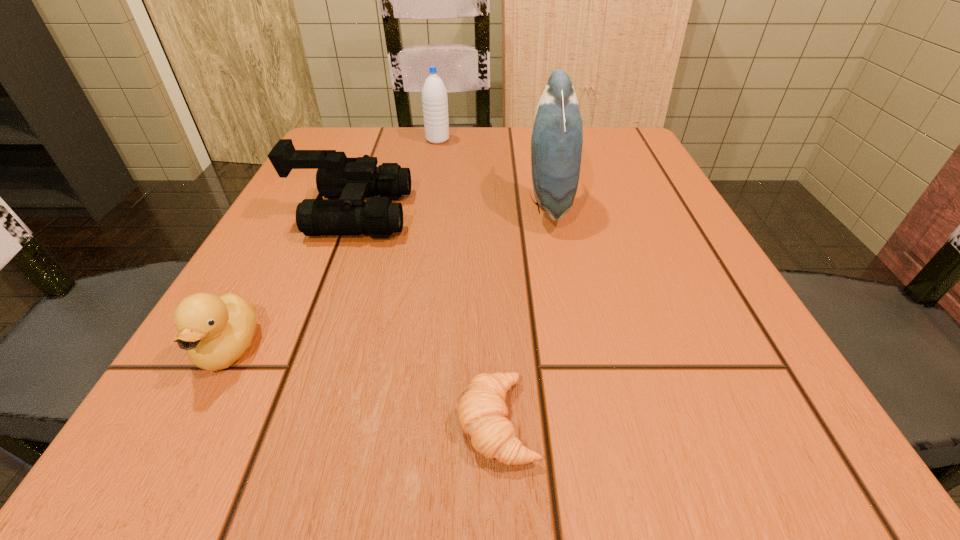
Where is `the tallest object`? The image size is (960, 540). the tallest object is located at coordinates click(x=557, y=136).

Identify the location of bird. The image size is (960, 540). (557, 136).

This screenshot has height=540, width=960. I want to click on the farthest object, so click(x=434, y=94).

Where is `the fourth shortest object`? Image resolution: width=960 pixels, height=540 pixels. the fourth shortest object is located at coordinates (434, 94).

Find the location of a particular element. the third shortest object is located at coordinates (351, 180).

This screenshot has width=960, height=540. I want to click on the fourth tallest object, so click(x=215, y=331).

You are a GUI agent. You are given a task and a screenshot of the screen. Output one action in this format:
    pyautogui.click(x=<x>, y=<y>)
    Task: Click on the shortest object
    
    Given the screenshot: What is the action you would take?
    pyautogui.click(x=482, y=412)

Locate an element on the screen. the second object from right to left is located at coordinates (482, 412).

This screenshot has width=960, height=540. What are the coordinates of `free space located 0.150m at the tip of the bird's beak` in the screenshot? It's located at (445, 203).

This screenshot has height=540, width=960. I want to click on vacant space located at the tip of the bird's beak, so click(468, 203).